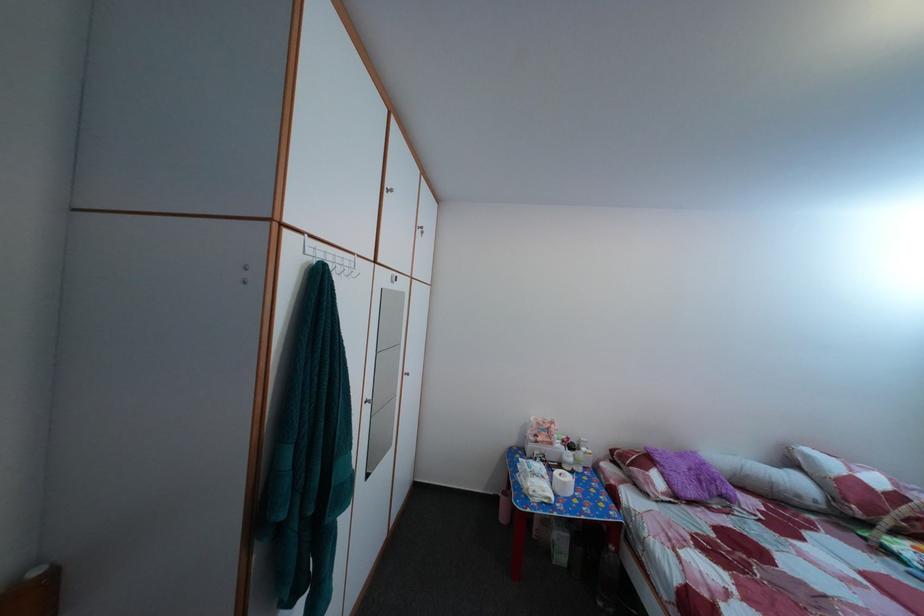
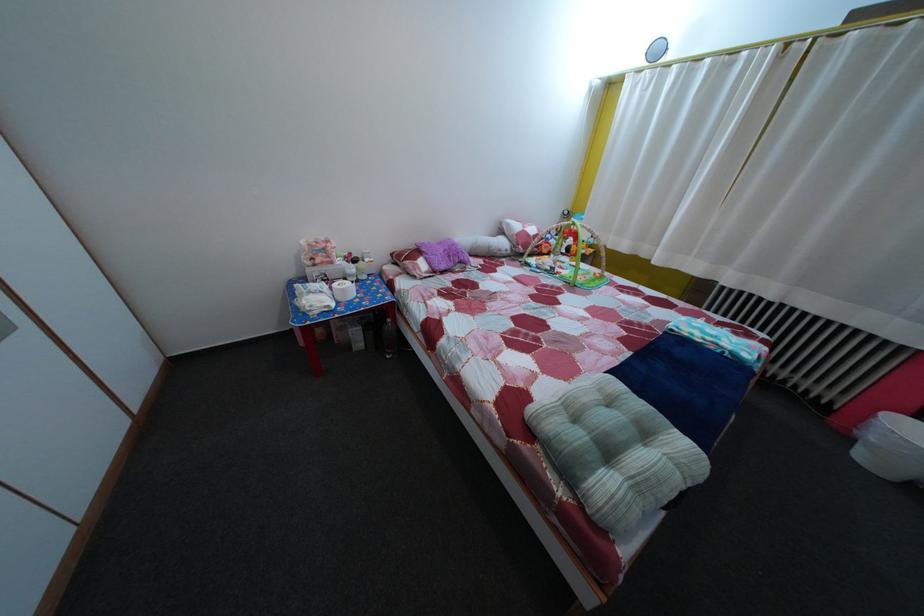
The images are taken continuously from a first-person perspective. In which direction is your viewpoint rotating?

The camera rotated toward right-down.